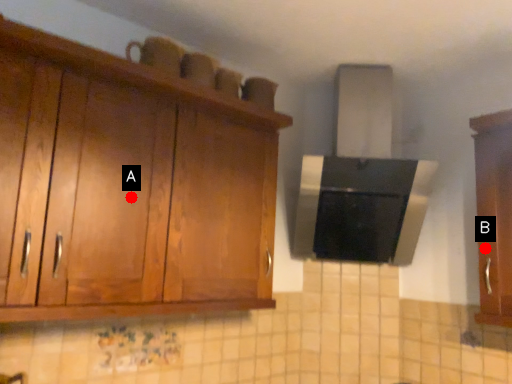
Question: Two points are circled on the image, labeled by A and B beside each circle. Which point is closer to the camera?

Choices:
 (A) A is closer
 (B) B is closer

Answer: (A)